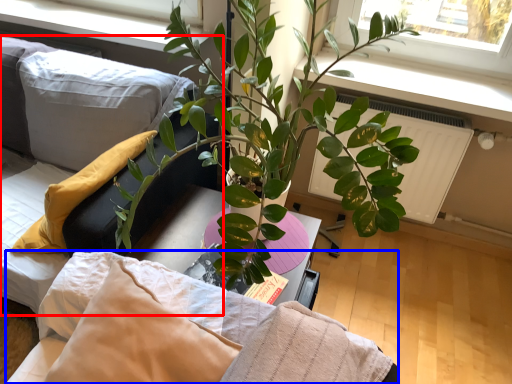
Question: Which object appears closest to the camera in this image, couch (highlighted by a red box) or bedding (highlighted by a blue box)?

Choices:
 (A) couch
 (B) bedding

Answer: (B)